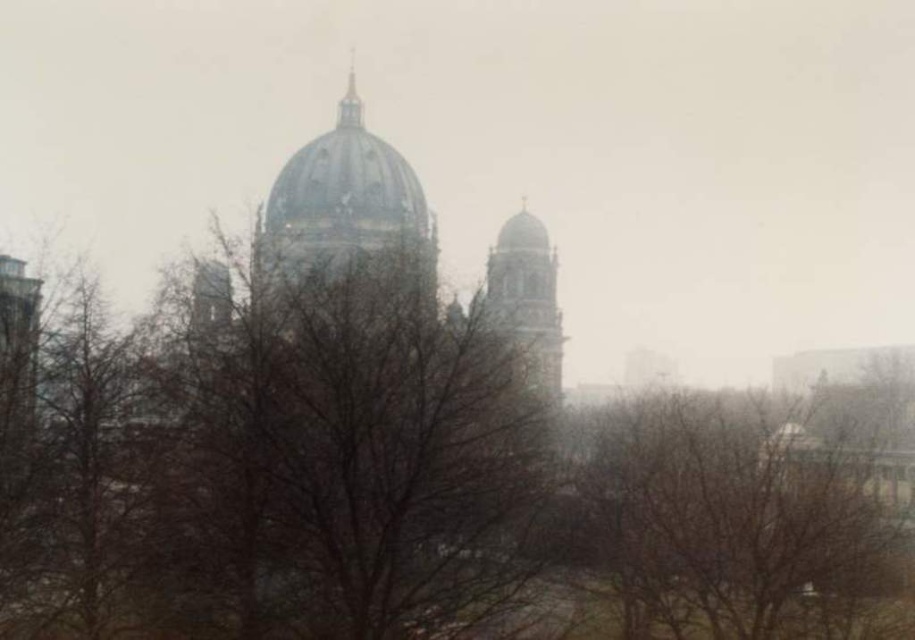
You are a photographer planning to take a photo of the brown leafless branches at center and the gold metallic spire at upper center. The camera you are using has a maximum focus range of 45 meters. Can you capture both objects in focus without moving the camera?

The brown leafless branches at center and gold metallic spire at upper center are 46.72 meters apart. Since the distance between them exceeds the camera maximum focus range of 45 meters, you cannot capture both objects in focus without moving the camera.

You are standing in front of the cathedral with a small drone. You want to fly the drone to the brown leafless tree at center. What are the coordinates to fly the drone to?

The coordinates to fly the drone to the brown leafless tree at center are point (735, 522).